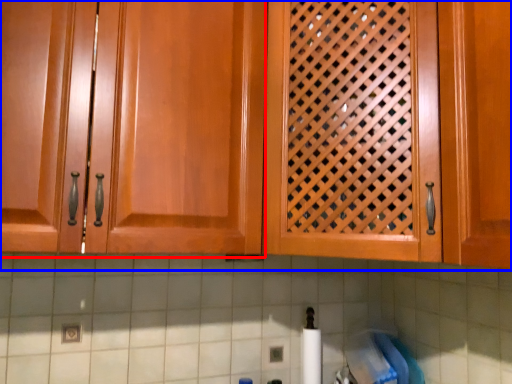
Question: Which object appears closest to the camera in this image, cabinetry (highlighted by a red box) or cabinetry (highlighted by a blue box)?

Choices:
 (A) cabinetry
 (B) cabinetry

Answer: (A)